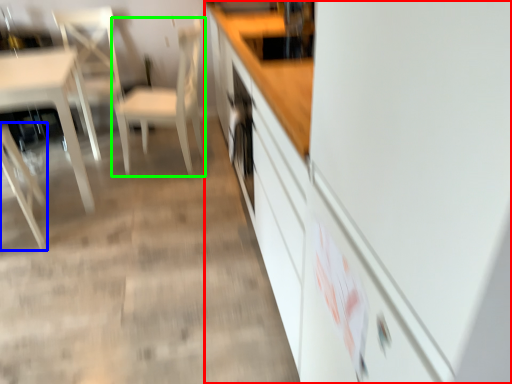
Question: Which object is the farthest from cabinetry (highlighted by a red box)? Choose among these: chair (highlighted by a blue box) or chair (highlighted by a green box).

Choices:
 (A) chair
 (B) chair

Answer: (A)